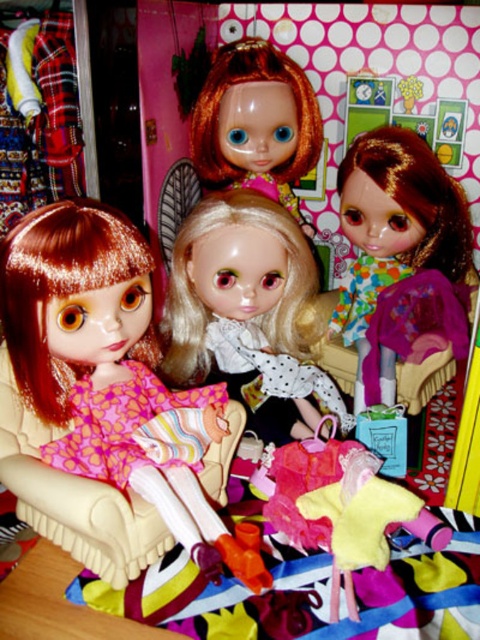
From the picture: Between shiny pink dress at center and matte pink fabric dress at center, which one appears on the left side from the viewer's perspective?

shiny pink dress at center is more to the left.

Can you confirm if shiny pink dress at center is bigger than matte pink fabric dress at center?

Yes.

The image size is (480, 640). Describe the element at coordinates (103, 392) in the screenshot. I see `shiny pink dress at center` at that location.

Locate an element on the screen. The image size is (480, 640). shiny pink dress at center is located at coordinates (103, 392).

Can you confirm if shiny purple fabric at center is thinner than shiny brown hair at upper center?

No, shiny purple fabric at center is not thinner than shiny brown hair at upper center.

Find the location of `shiny purple fabric at center`. shiny purple fabric at center is located at coordinates (394, 241).

Between matte pink fabric dress at center and shiny brown hair at upper center, which one is positioned lower?

matte pink fabric dress at center

Does matte pink fabric dress at center have a lesser height compared to shiny brown hair at upper center?

Yes.

Identify the location of matte pink fabric dress at center. The width and height of the screenshot is (480, 640). (343, 508).